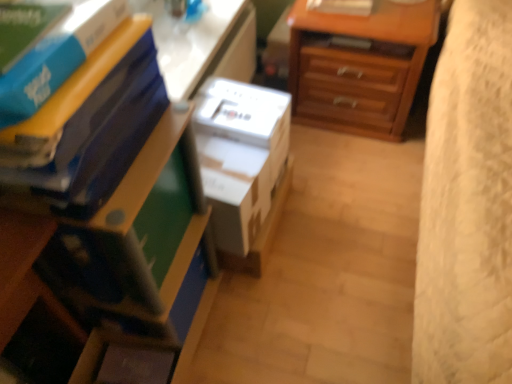
Question: Would you say matte plastic nightstand at lower left contains matte blue paperback book at left, the second paperback book in the back-to-front sequence?

Choices:
 (A) no
 (B) yes

Answer: (A)

Question: From a real-world perspective, does matte plastic nightstand at lower left stand above matte blue paperback book at left, which ranks as the second paperback book in front-to-back order?

Choices:
 (A) no
 (B) yes

Answer: (A)

Question: Considering the relative sizes of matte plastic nightstand at lower left and matte blue paperback book at left, which ranks as the second paperback book in front-to-back order, in the image provided, is matte plastic nightstand at lower left wider than matte blue paperback book at left, which ranks as the second paperback book in front-to-back order,?

Choices:
 (A) yes
 (B) no

Answer: (A)

Question: Is matte plastic nightstand at lower left turned away from matte blue paperback book at left, which ranks as the second paperback book in front-to-back order?

Choices:
 (A) no
 (B) yes

Answer: (A)

Question: Considering the relative sizes of matte plastic nightstand at lower left and matte blue paperback book at left, which ranks as the second paperback book in front-to-back order, in the image provided, is matte plastic nightstand at lower left taller than matte blue paperback book at left, which ranks as the second paperback book in front-to-back order,?

Choices:
 (A) no
 (B) yes

Answer: (B)

Question: Looking at their shapes, would you say matte blue paperback book at left, the second paperback book in the back-to-front sequence, is wider or thinner than white plastic table at upper center?

Choices:
 (A) thin
 (B) wide

Answer: (B)

Question: In terms of height, does matte blue paperback book at left, the second paperback book in the back-to-front sequence, look taller or shorter compared to white plastic table at upper center?

Choices:
 (A) short
 (B) tall

Answer: (B)

Question: Do you think matte blue paperback book at left, which ranks as the second paperback book in front-to-back order, is within white plastic table at upper center, or outside of it?

Choices:
 (A) inside
 (B) outside

Answer: (B)

Question: Based on their positions, is matte blue paperback book at left, which ranks as the second paperback book in front-to-back order, located to the left or right of white plastic table at upper center?

Choices:
 (A) right
 (B) left

Answer: (B)

Question: From a real-world perspective, relative to white cardboard box at center, is blue matte book at upper left, the 1th paperback book in the front-to-back sequence, vertically above or below?

Choices:
 (A) above
 (B) below

Answer: (A)

Question: Considering the positions of blue matte book at upper left, the 3th paperback book when ordered from back to front, and white cardboard box at center in the image, is blue matte book at upper left, the 3th paperback book when ordered from back to front, taller or shorter than white cardboard box at center?

Choices:
 (A) tall
 (B) short

Answer: (B)

Question: Choose the correct answer: Is blue matte book at upper left, the 1th paperback book in the front-to-back sequence, inside white cardboard box at center or outside it?

Choices:
 (A) inside
 (B) outside

Answer: (B)

Question: Considering the positions of point (36, 69) and point (279, 134), is point (36, 69) closer or farther from the camera than point (279, 134)?

Choices:
 (A) closer
 (B) farther

Answer: (A)

Question: Looking at their shapes, would you say blue matte book at upper left, the 1th paperback book in the front-to-back sequence, is wider or thinner than white plastic table at upper center?

Choices:
 (A) thin
 (B) wide

Answer: (A)

Question: Is blue matte book at upper left, the 3th paperback book when ordered from back to front, spatially inside white plastic table at upper center, or outside of it?

Choices:
 (A) inside
 (B) outside

Answer: (B)